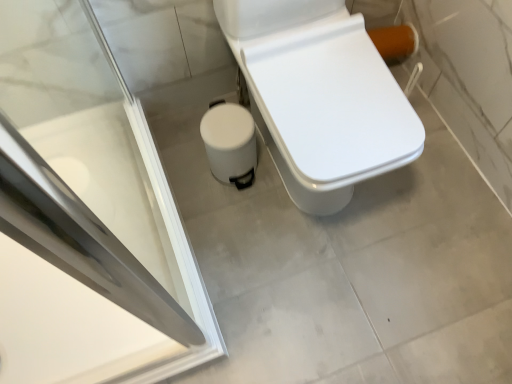
This screenshot has width=512, height=384. In order to click on white glossy toilet at center in this screenshot , I will do `click(320, 97)`.

Describe the element at coordinates (230, 143) in the screenshot. I see `white matte trash can at lower center` at that location.

Describe the element at coordinates (87, 216) in the screenshot. I see `transparent glass screen door at upper left` at that location.

In order to click on white glossy toilet at center in this screenshot , I will do `click(320, 97)`.

From a real-world perspective, which object stands above the other?

In real-world perspective, transparent glass screen door at upper left is above.

Is transparent glass screen door at upper left bigger or smaller than white glossy toilet at center?

In the image, transparent glass screen door at upper left appears to be smaller than white glossy toilet at center.

Is transparent glass screen door at upper left taller than white glossy toilet at center?

Correct, transparent glass screen door at upper left is much taller as white glossy toilet at center.

Is transparent glass screen door at upper left closer to the viewer compared to white glossy toilet at center?

Yes.

Is white matte trash can at lower center to the right of white glossy toilet at center from the viewer's perspective?

No, white matte trash can at lower center is not to the right of white glossy toilet at center.

The height and width of the screenshot is (384, 512). In the image, there is a white glossy toilet at center. In order to click on potty below it (from a real-world perspective) in this screenshot , I will do `click(230, 143)`.

Is white matte trash can at lower center not inside white glossy toilet at center?

Indeed, white matte trash can at lower center is completely outside white glossy toilet at center.

How different are the orientations of white matte trash can at lower center and white glossy toilet at center in degrees?

white matte trash can at lower center and white glossy toilet at center are facing 0.000496 degrees away from each other.

Between point (323, 11) and point (89, 311), which one is positioned behind?

The point (323, 11) is farther from the camera.

Which object is closer to the camera, white glossy toilet at center or transparent glass screen door at upper left?

transparent glass screen door at upper left is more forward.

Consider the image. Can you confirm if white glossy toilet at center is bigger than transparent glass screen door at upper left?

Indeed, white glossy toilet at center has a larger size compared to transparent glass screen door at upper left.

Consider the image. Which is correct: transparent glass screen door at upper left is inside white matte trash can at lower center, or outside of it?

transparent glass screen door at upper left is spatially situated outside white matte trash can at lower center.

Consider the image. From a real-world perspective, between transparent glass screen door at upper left and white matte trash can at lower center, who is vertically higher?

transparent glass screen door at upper left, from a real-world perspective.

Which is closer, (x=313, y=213) or (x=207, y=133)?

Point (x=313, y=213) is farther from the camera than point (x=207, y=133).

Considering the positions of objects white glossy toilet at center and white matte trash can at lower center in the image provided, who is more to the right, white glossy toilet at center or white matte trash can at lower center?

white glossy toilet at center.

Does white glossy toilet at center touch white matte trash can at lower center?

No, white glossy toilet at center is not in contact with white matte trash can at lower center.

What's the angular difference between white matte trash can at lower center and transparent glass screen door at upper left's facing directions?

The angular difference between white matte trash can at lower center and transparent glass screen door at upper left is 1.85 degrees.

Is white matte trash can at lower center in front of or behind transparent glass screen door at upper left in the image?

white matte trash can at lower center is behind transparent glass screen door at upper left.

Which of these two, white matte trash can at lower center or transparent glass screen door at upper left, is smaller?

With smaller size is white matte trash can at lower center.

Locate an element on the screen. The width and height of the screenshot is (512, 384). potty below the transparent glass screen door at upper left (from a real-world perspective) is located at coordinates (230, 143).

What are the coordinates of `toilet that appears above the transparent glass screen door at upper left (from the image's perspective)` in the screenshot? It's located at (320, 97).

The image size is (512, 384). What are the coordinates of `toilet on the right of white matte trash can at lower center` in the screenshot? It's located at (320, 97).

Based on their spatial positions, is transparent glass screen door at upper left or white matte trash can at lower center closer to white glossy toilet at center?

white matte trash can at lower center is closer to white glossy toilet at center.

Estimate the real-world distances between objects in this image. Which object is further from transparent glass screen door at upper left, white glossy toilet at center or white matte trash can at lower center?

The object further to transparent glass screen door at upper left is white glossy toilet at center.

Consider the image. Estimate the real-world distances between objects in this image. Which object is further from white glossy toilet at center, white matte trash can at lower center or transparent glass screen door at upper left?

transparent glass screen door at upper left lies further to white glossy toilet at center than the other object.

Estimate the real-world distances between objects in this image. Which object is further from transparent glass screen door at upper left, white matte trash can at lower center or white glossy toilet at center?

Based on the image, white glossy toilet at center appears to be further to transparent glass screen door at upper left.

When comparing their distances from white matte trash can at lower center, does white glossy toilet at center or transparent glass screen door at upper left seem closer?

Among the two, white glossy toilet at center is located nearer to white matte trash can at lower center.

From the image, which object appears to be nearer to white matte trash can at lower center, transparent glass screen door at upper left or white glossy toilet at center?

white glossy toilet at center is positioned closer to the anchor white matte trash can at lower center.

Find the location of a particular element. toilet positioned between transparent glass screen door at upper left and white matte trash can at lower center from near to far is located at coordinates (320, 97).